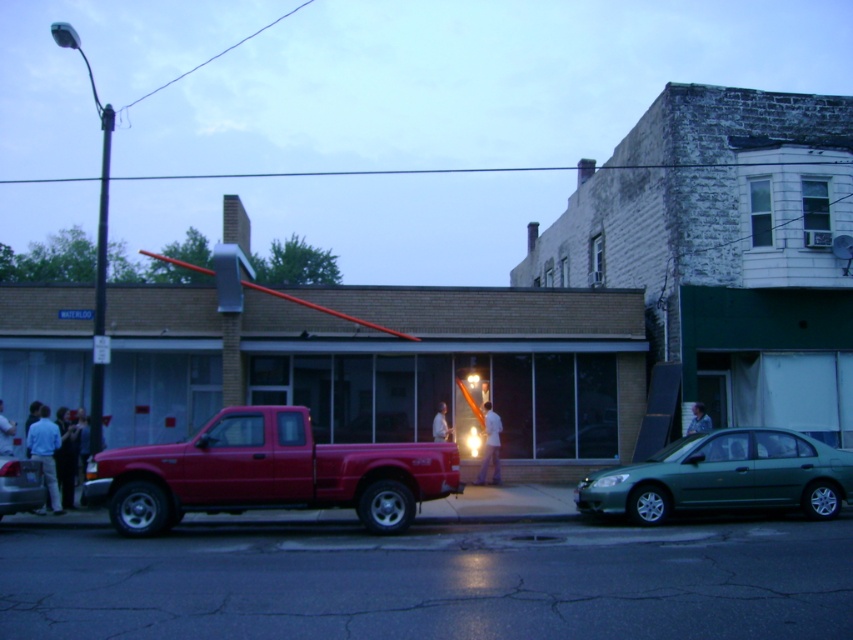
Is point (41, 460) closer to viewer compared to point (447, 428)?

That is True.

Is light blue shirt at left taller than white fabric shirt at center?

Yes, light blue shirt at left is taller than white fabric shirt at center.

Between point (51, 433) and point (434, 419), which one is positioned behind?

Point (434, 419)

Where is `light blue shirt at left`? light blue shirt at left is located at coordinates (45, 452).

Is matte red truck at center taller than green metallic sedan at lower right?

Indeed, matte red truck at center has a greater height compared to green metallic sedan at lower right.

In the scene shown: Which of these two, matte red truck at center or green metallic sedan at lower right, stands taller?

matte red truck at center

Who is more forward, (x=396, y=504) or (x=665, y=451)?

Point (x=396, y=504) is more forward.

The image size is (853, 640). I want to click on matte red truck at center, so click(267, 474).

Which of these two, light blue shirt at left or white matte shirt at center, stands taller?

light blue shirt at left

Is light blue shirt at left above white matte shirt at center?

Correct, light blue shirt at left is located above white matte shirt at center.

Does point (35, 458) come in front of point (496, 483)?

Yes, it is.

Where is `light blue shirt at left`? light blue shirt at left is located at coordinates (45, 452).